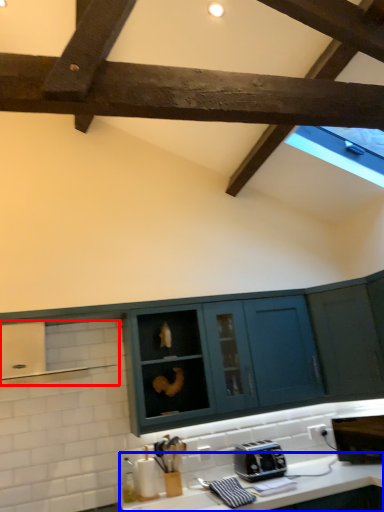
Question: Among these objects, which one is farthest to the camera, exhaust hood (highlighted by a red box) or countertop (highlighted by a blue box)?

Choices:
 (A) exhaust hood
 (B) countertop

Answer: (A)